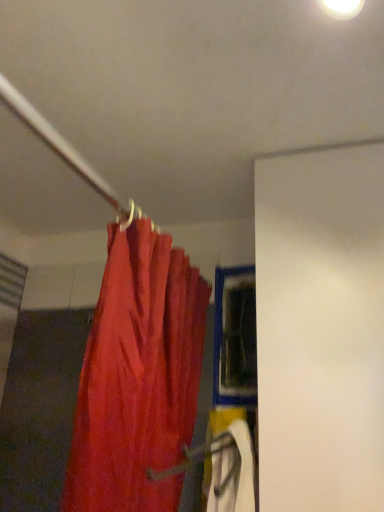
What is the approximate height of blue plastic window at center?

15.78 inches.

Describe the element at coordinates (235, 337) in the screenshot. I see `blue plastic window at center` at that location.

The image size is (384, 512). I want to click on blue plastic window at center, so click(x=235, y=337).

Locate an element on the screen. matte red curtain at upper left is located at coordinates (138, 376).

This screenshot has width=384, height=512. What do you see at coordinates (138, 376) in the screenshot? I see `matte red curtain at upper left` at bounding box center [138, 376].

Find the location of a particular element. This screenshot has height=512, width=384. blue plastic window at center is located at coordinates (235, 337).

Considering the positions of objects blue plastic window at center and matte red curtain at upper left in the image provided, who is more to the right, blue plastic window at center or matte red curtain at upper left?

Positioned to the right is blue plastic window at center.

Is blue plastic window at center in front of or behind matte red curtain at upper left in the image?

blue plastic window at center is positioned farther from the viewer than matte red curtain at upper left.

Which is closer, [228,330] or [86,376]?

Point [228,330] appears to be farther away from the viewer than point [86,376].

From the image's perspective, which is below, blue plastic window at center or matte red curtain at upper left?

matte red curtain at upper left is shown below in the image.

From a real-world perspective, which object stands above the other?

blue plastic window at center.

Looking at their sizes, would you say blue plastic window at center is wider or thinner than matte red curtain at upper left?

Clearly, blue plastic window at center has less width compared to matte red curtain at upper left.

Is blue plastic window at center shorter than matte red curtain at upper left?

Yes.

Does blue plastic window at center have a smaller size compared to matte red curtain at upper left?

Yes, blue plastic window at center is smaller than matte red curtain at upper left.

Is blue plastic window at center located outside matte red curtain at upper left?

That's correct, blue plastic window at center is outside of matte red curtain at upper left.

Consider the image. Is blue plastic window at center not near matte red curtain at upper left?

blue plastic window at center is near matte red curtain at upper left, not far away.

Is blue plastic window at center facing towards matte red curtain at upper left?

Yes, blue plastic window at center faces towards matte red curtain at upper left.

How different are the orientations of blue plastic window at center and matte red curtain at upper left in degrees?

They differ by 87.1 degrees in their facing directions.

Measure the distance from blue plastic window at center to matte red curtain at upper left.

A distance of 12.71 inches exists between blue plastic window at center and matte red curtain at upper left.

Identify the location of curtain to the left of blue plastic window at center. The height and width of the screenshot is (512, 384). (138, 376).

In the scene shown: Visually, is matte red curtain at upper left positioned to the left or to the right of blue plastic window at center?

From the image, it's evident that matte red curtain at upper left is to the left of blue plastic window at center.

Is matte red curtain at upper left behind blue plastic window at center?

No, the depth of matte red curtain at upper left is less than that of blue plastic window at center.

Considering the points (128, 233) and (254, 347), which point is in front, point (128, 233) or point (254, 347)?

Positioned in front is point (128, 233).

From the image's perspective, is matte red curtain at upper left positioned above or below blue plastic window at center?

Based on their image positions, matte red curtain at upper left is located beneath blue plastic window at center.

From a real-world perspective, is matte red curtain at upper left physically located above or below blue plastic window at center?

matte red curtain at upper left is below blue plastic window at center.

Between matte red curtain at upper left and blue plastic window at center, which one has larger width?

matte red curtain at upper left.

Is matte red curtain at upper left taller than blue plastic window at center?

Yes, matte red curtain at upper left is taller than blue plastic window at center.

Can you confirm if matte red curtain at upper left is bigger than blue plastic window at center?

Yes, matte red curtain at upper left is bigger than blue plastic window at center.

Could blue plastic window at center be considered to be inside matte red curtain at upper left?

No.

Is matte red curtain at upper left directly adjacent to blue plastic window at center?

No, matte red curtain at upper left is not touching blue plastic window at center.

Is matte red curtain at upper left facing towards blue plastic window at center?

No, matte red curtain at upper left is not oriented towards blue plastic window at center.

How different are the orientations of matte red curtain at upper left and blue plastic window at center in degrees?

The angle between the facing direction of matte red curtain at upper left and the facing direction of blue plastic window at center is 87.1 degrees.

How far apart are matte red curtain at upper left and blue plastic window at center?

12.71 inches.

Locate an element on the screen. window that appears above the matte red curtain at upper left (from a real-world perspective) is located at coordinates (235, 337).

Where is `curtain located underneath the blue plastic window at center (from a real-world perspective)`? Image resolution: width=384 pixels, height=512 pixels. curtain located underneath the blue plastic window at center (from a real-world perspective) is located at coordinates (138, 376).

Locate an element on the screen. window above the matte red curtain at upper left (from the image's perspective) is located at coordinates (235, 337).